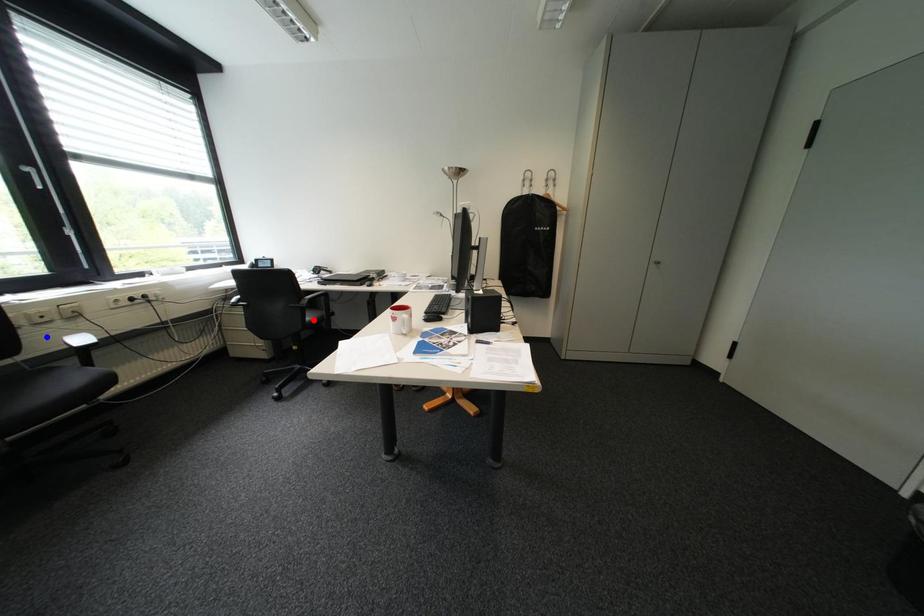
Question: Which of the two points in the image is closer to the camera?

Choices:
 (A) Blue point is closer.
 (B) Red point is closer.

Answer: (A)